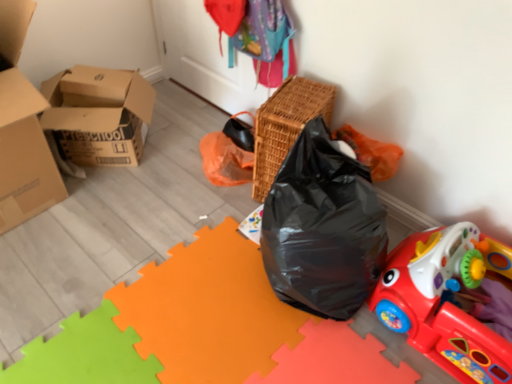
Question: In terms of height, does rubberized plastic toy car at lower right look taller or shorter compared to woven brown basket at upper center?

Choices:
 (A) short
 (B) tall

Answer: (A)

Question: Is rubberized plastic toy car at lower right inside or outside of woven brown basket at upper center?

Choices:
 (A) inside
 (B) outside

Answer: (B)

Question: Estimate the real-world distances between objects in this image. Which object is farther from the rubberized plastic toy car at lower right?

Choices:
 (A) woven brown basket at upper center
 (B) cardboard boxes at left

Answer: (B)

Question: Which object is the closest to the woven brown basket at upper center?

Choices:
 (A) cardboard boxes at left
 (B) rubberized plastic toy car at lower right

Answer: (B)